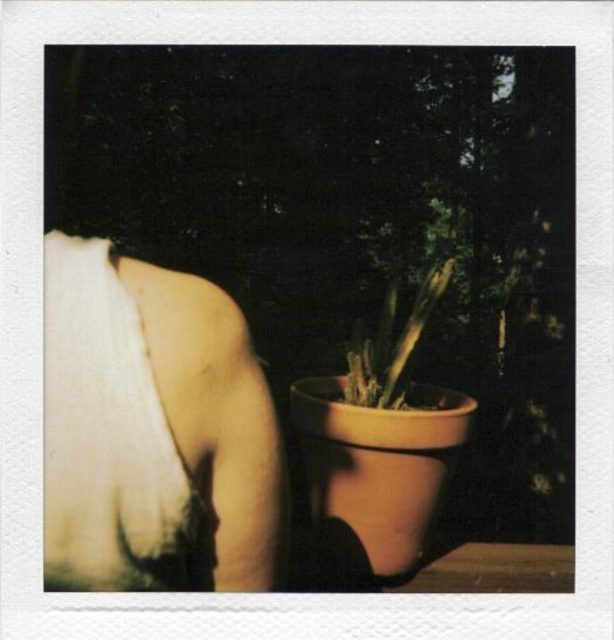
Question: Is white cotton bandage at upper left to the right of matte clay pot at center from the viewer's perspective?

Choices:
 (A) no
 (B) yes

Answer: (A)

Question: Observing the image, what is the correct spatial positioning of white cotton bandage at upper left in reference to matte clay pot at center?

Choices:
 (A) above
 (B) below

Answer: (B)

Question: Which point is closer to the camera?

Choices:
 (A) (101, 470)
 (B) (424, 298)

Answer: (A)

Question: Which point is closer to the camera?

Choices:
 (A) (60, 323)
 (B) (354, 387)

Answer: (A)

Question: Does white cotton bandage at upper left have a smaller size compared to matte clay pot at center?

Choices:
 (A) yes
 (B) no

Answer: (A)

Question: Which point is farther from the camera taking this photo?

Choices:
 (A) (389, 342)
 (B) (157, 396)

Answer: (A)